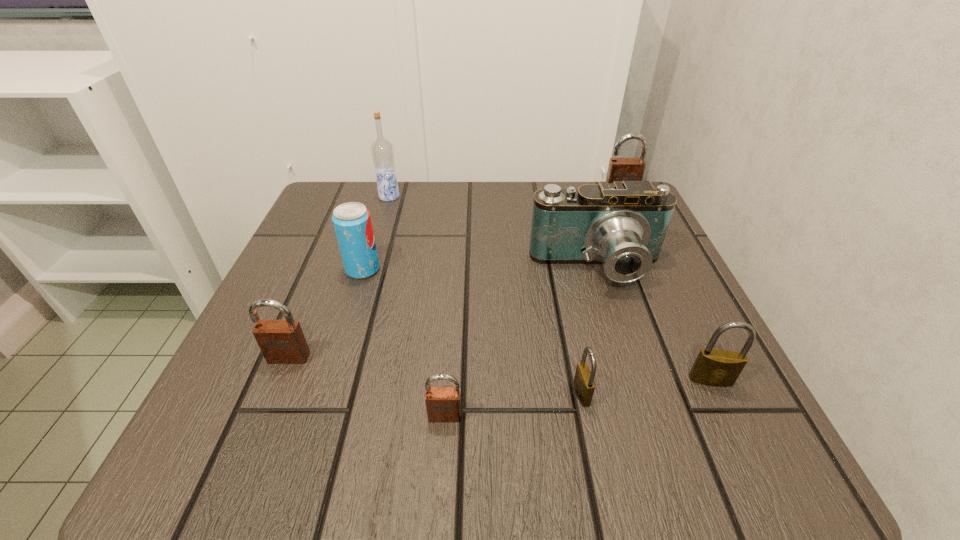
Locate an element on the screen. the left brass padlock is located at coordinates (584, 385).

At what (x,y) coordinates should I click in order to perform the action: click on the nearest padlock. Please return your answer as a coordinate pair (x, y). The width and height of the screenshot is (960, 540). Looking at the image, I should click on (443, 404).

Locate an element on the screen. The width and height of the screenshot is (960, 540). the fifth object from right to left is located at coordinates (443, 404).

Identify the location of free space located on the right of the tallest object. (534, 197).

This screenshot has width=960, height=540. In order to click on free location located on the front-facing side of the farthest brown padlock in this screenshot , I will do `click(646, 252)`.

Identify the location of blank area located on the front-facing side of the camcorder. (631, 376).

Identify the location of vacant point located 0.280m on the front of the soda can. This screenshot has width=960, height=540. (317, 418).

Where is `vacant space situated 0.160m on the front-facing side of the fourth nearest object`? This screenshot has height=540, width=960. vacant space situated 0.160m on the front-facing side of the fourth nearest object is located at coordinates (243, 469).

The height and width of the screenshot is (540, 960). What are the coordinates of `vacant space situated 0.380m on the back of the bigger brass padlock` in the screenshot? It's located at (637, 226).

What are the coordinates of `free space located 0.350m on the left of the left brass padlock` in the screenshot? It's located at point(326,394).